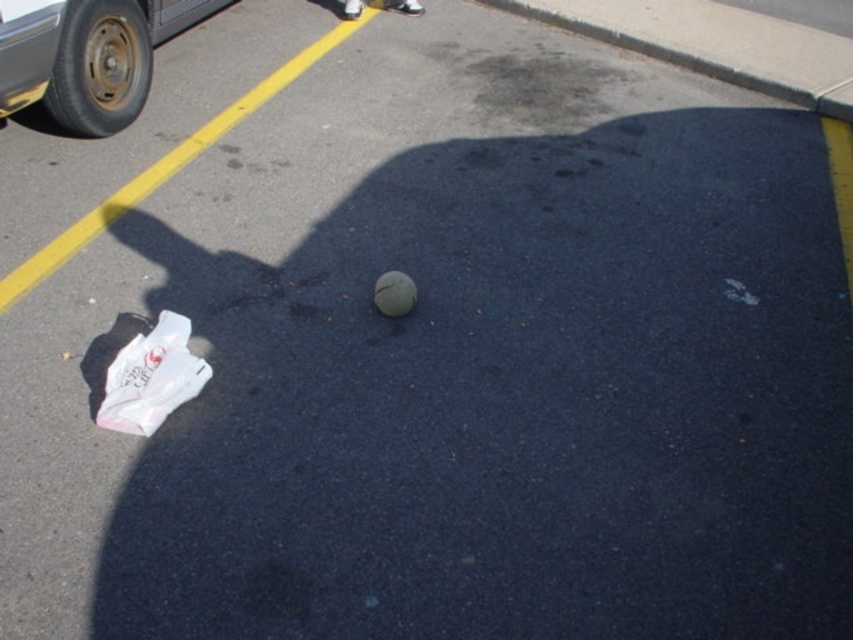
Question: Is white plastic bag at lower left above white matte ball at center?

Choices:
 (A) yes
 (B) no

Answer: (B)

Question: Which object appears farthest from the camera in this image?

Choices:
 (A) white plastic bag at lower left
 (B) white matte ball at center

Answer: (B)

Question: Does white plastic bag at lower left appear on the right side of white matte ball at center?

Choices:
 (A) no
 (B) yes

Answer: (A)

Question: Which point is farther to the camera?

Choices:
 (A) white matte ball at center
 (B) white plastic bag at lower left

Answer: (A)

Question: Can you confirm if white plastic bag at lower left is positioned to the right of white matte ball at center?

Choices:
 (A) no
 (B) yes

Answer: (A)